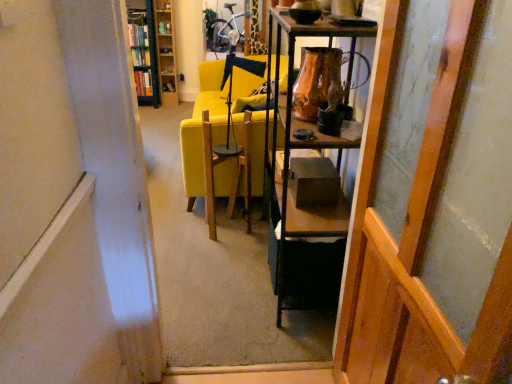
Question: Considering the relative sizes of wooden bookshelf at upper left, the 2th cabinetry in the left-to-right sequence, and wooden chair at center in the image provided, is wooden bookshelf at upper left, the 2th cabinetry in the left-to-right sequence, wider than wooden chair at center?

Choices:
 (A) no
 (B) yes

Answer: (A)

Question: Is wooden bookshelf at upper left, which ranks as the 1th cabinetry in right-to-left order, bigger than wooden chair at center?

Choices:
 (A) yes
 (B) no

Answer: (B)

Question: Is wooden bookshelf at upper left, which ranks as the 1th cabinetry in right-to-left order, outside of wooden chair at center?

Choices:
 (A) no
 (B) yes

Answer: (B)

Question: Considering the relative sizes of wooden bookshelf at upper left, the 2th cabinetry in the left-to-right sequence, and wooden chair at center in the image provided, is wooden bookshelf at upper left, the 2th cabinetry in the left-to-right sequence, thinner than wooden chair at center?

Choices:
 (A) yes
 (B) no

Answer: (A)

Question: Is the depth of wooden bookshelf at upper left, which ranks as the 1th cabinetry in right-to-left order, less than that of wooden chair at center?

Choices:
 (A) yes
 (B) no

Answer: (B)

Question: From a real-world perspective, is green metal bookshelf at upper left, marked as the first cabinetry in a left-to-right arrangement, positioned above or below wooden chair at center?

Choices:
 (A) below
 (B) above

Answer: (B)

Question: In the image, is green metal bookshelf at upper left, which is the 2th cabinetry in right-to-left order, on the left side or the right side of wooden chair at center?

Choices:
 (A) left
 (B) right

Answer: (A)

Question: In terms of width, does green metal bookshelf at upper left, which is the 2th cabinetry in right-to-left order, look wider or thinner when compared to wooden chair at center?

Choices:
 (A) wide
 (B) thin

Answer: (A)

Question: Considering the positions of point (135, 41) and point (260, 162), is point (135, 41) closer or farther from the camera than point (260, 162)?

Choices:
 (A) closer
 (B) farther

Answer: (B)

Question: From a real-world perspective, is wooden chair at center above or below wooden bookshelf at upper left, which ranks as the 1th cabinetry in right-to-left order?

Choices:
 (A) below
 (B) above

Answer: (A)

Question: Would you say wooden chair at center is inside or outside wooden bookshelf at upper left, which ranks as the 1th cabinetry in right-to-left order?

Choices:
 (A) inside
 (B) outside

Answer: (B)

Question: Is point (249, 188) closer or farther from the camera than point (162, 38)?

Choices:
 (A) closer
 (B) farther

Answer: (A)

Question: Looking at their shapes, would you say wooden chair at center is wider or thinner than wooden bookshelf at upper left, which ranks as the 1th cabinetry in right-to-left order?

Choices:
 (A) thin
 (B) wide

Answer: (B)

Question: In the image, is yellow fabric couch at center positioned in front of or behind green metal bookshelf at upper left, marked as the first cabinetry in a left-to-right arrangement?

Choices:
 (A) front
 (B) behind

Answer: (A)

Question: Considering the positions of yellow fabric couch at center and green metal bookshelf at upper left, marked as the first cabinetry in a left-to-right arrangement, in the image, is yellow fabric couch at center taller or shorter than green metal bookshelf at upper left, marked as the first cabinetry in a left-to-right arrangement,?

Choices:
 (A) tall
 (B) short

Answer: (B)